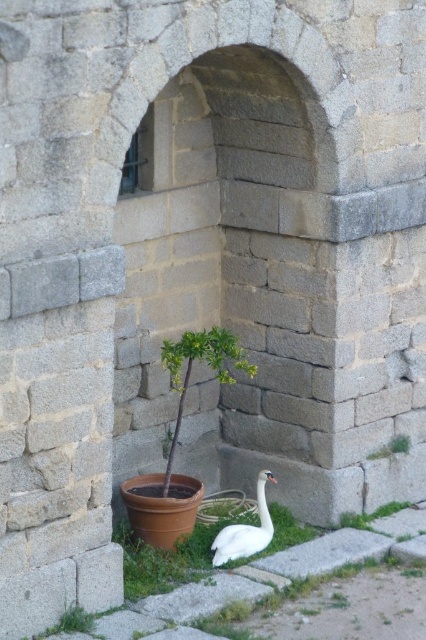
Is green leafy plant at center closer to the viewer compared to green leafy plant at lower right?

Yes, green leafy plant at center is in front of green leafy plant at lower right.

Does green leafy plant at center appear on the right side of green leafy plant at lower right?

Incorrect, green leafy plant at center is not on the right side of green leafy plant at lower right.

Is point (253, 364) more distant than point (400, 440)?

No, (253, 364) is closer to viewer.

You are a GUI agent. You are given a task and a screenshot of the screen. Output one action in this format:
    pyautogui.click(x=<x>, y=<y>)
    Task: Click on the green leafy plant at center
    The height and width of the screenshot is (640, 426).
    Given the screenshot: What is the action you would take?
    pyautogui.click(x=199, y=362)

Image resolution: width=426 pixels, height=640 pixels. I want to click on green leafy plant at center, so click(x=199, y=362).

Describe the element at coordinates (199, 362) in the screenshot. This screenshot has width=426, height=640. I see `green leafy plant at center` at that location.

Is point (215, 326) more distant than point (238, 550)?

Yes, it is behind point (238, 550).

What are the coordinates of `green leafy plant at center` in the screenshot? It's located at (199, 362).

In the scene shown: Is white glossy swan at lower center wider than green leafy plant at lower right?

Indeed, white glossy swan at lower center has a greater width compared to green leafy plant at lower right.

This screenshot has width=426, height=640. What do you see at coordinates (245, 531) in the screenshot?
I see `white glossy swan at lower center` at bounding box center [245, 531].

This screenshot has height=640, width=426. In order to click on white glossy swan at lower center in this screenshot , I will do `click(245, 531)`.